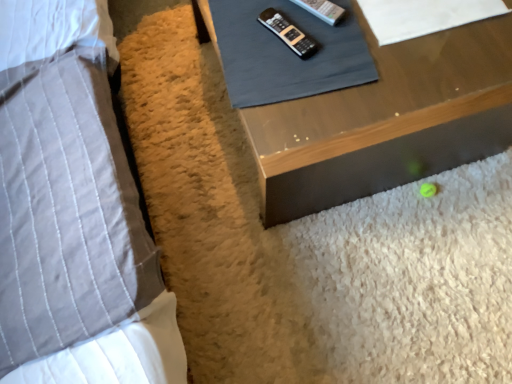
Locate an element on the screen. The height and width of the screenshot is (384, 512). free space above gray fabric remote control at upper center, which is the first sheet from left to right (from a real-world perspective) is located at coordinates (x=290, y=34).